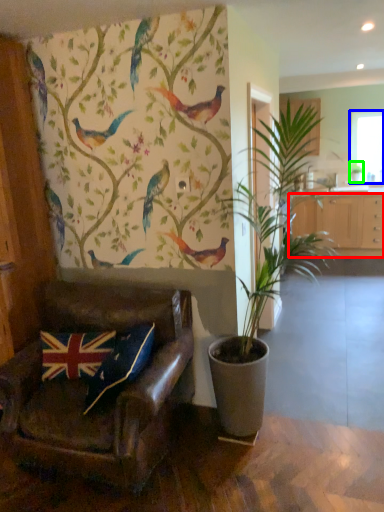
Question: Which object is the farthest from cabinetry (highlighted by a red box)? Choose among these: window screen (highlighted by a blue box) or houseplant (highlighted by a green box).

Choices:
 (A) window screen
 (B) houseplant

Answer: (A)